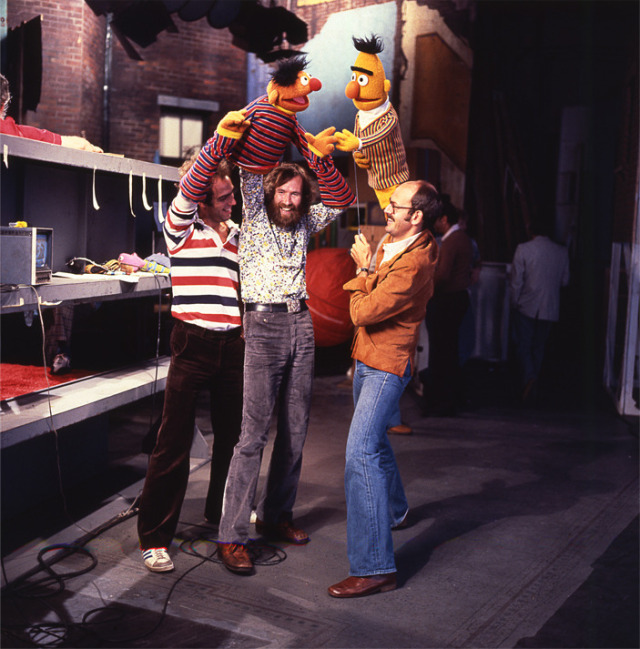
At what (x,y) coordinates should I click in order to perform the action: click on electric cords. Please return your answer as a coordinate pair (x, y). Looking at the image, I should click on (180, 579), (59, 478), (157, 359).